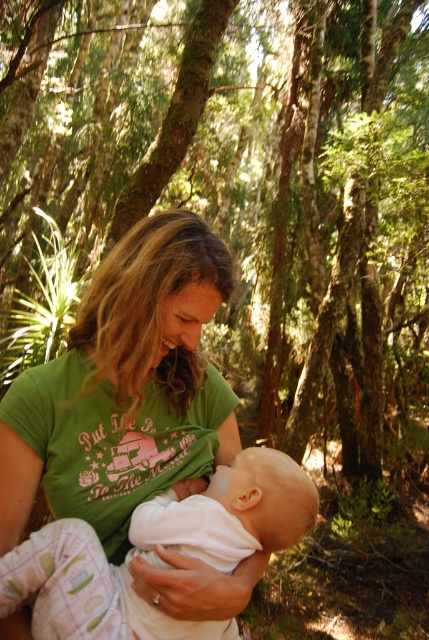
Question: Among these objects, which one is nearest to the camera?

Choices:
 (A) white soft baby at center
 (B) green cotton shirt at center

Answer: (A)

Question: Which object is closer to the camera taking this photo?

Choices:
 (A) green cotton shirt at center
 (B) white soft baby at center

Answer: (B)

Question: Which point appears farthest from the camera in this image?

Choices:
 (A) pos(189,532)
 (B) pos(204,369)

Answer: (B)

Question: Can you confirm if green cotton shirt at center is positioned below white soft baby at center?

Choices:
 (A) no
 (B) yes

Answer: (A)

Question: Is green cotton shirt at center smaller than white soft baby at center?

Choices:
 (A) yes
 (B) no

Answer: (B)

Question: Does green cotton shirt at center have a greater width compared to white soft baby at center?

Choices:
 (A) no
 (B) yes

Answer: (A)